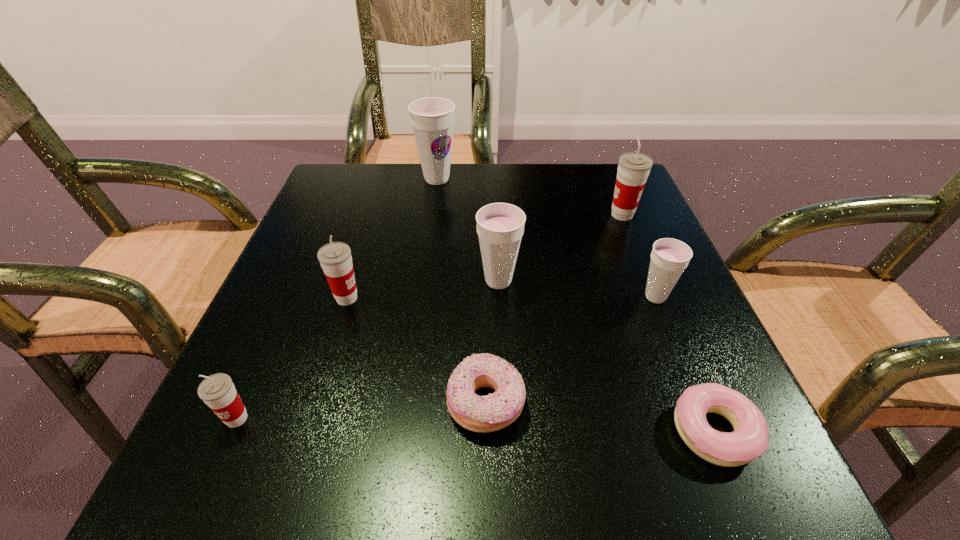
At what (x,y) coordinates should I click in order to perform the action: click on free space between the rightmost red cup and the nearest red cup. Please return your answer as a coordinate pair (x, y). This screenshot has width=960, height=540. Looking at the image, I should click on (429, 316).

What are the coordinates of `free space between the fifth nearest cup and the shortest object` in the screenshot? It's located at (668, 323).

Find the location of a particular element. This screenshot has height=540, width=960. free space between the third object from left to right and the second smallest purple cup is located at coordinates (468, 230).

At what (x,y) coordinates should I click in order to perform the action: click on empty space between the left doughnut and the third object from left to right. Please return your answer as a coordinate pair (x, y). Looking at the image, I should click on (461, 291).

Where is `free spot between the rightmost red cup and the nearest red cup`? This screenshot has height=540, width=960. free spot between the rightmost red cup and the nearest red cup is located at coordinates (429, 316).

I want to click on unoccupied area between the biggest purple cup and the rightmost red cup, so click(530, 197).

The image size is (960, 540). Find the location of `free space between the smallest purple cup and the biggest purple cup`. free space between the smallest purple cup and the biggest purple cup is located at coordinates (546, 238).

Choose which object is the sixth nearest neighbor to the second red cup from left to right. Please provide its 2D coordinates. Your answer should be formatted as a tuple, i.e. [(x, y)], where the tuple contains the x and y coordinates of a point satisfying the conditions above.

[(750, 438)]

I want to click on object identified as the fourth closest to the left doughnut, so click(669, 257).

Locate an element on the screen. cup that is the second nearest to the second red cup from right to left is located at coordinates (500, 226).